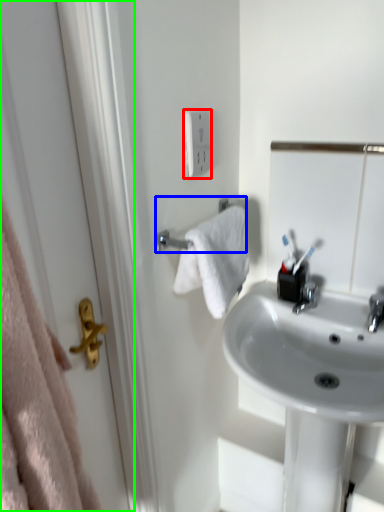
Question: Which object is positioned closest to electric outlet (highlighted by a red box)? Select from towel rack (highlighted by a blue box) and screen door (highlighted by a green box).

Choices:
 (A) towel rack
 (B) screen door

Answer: (A)